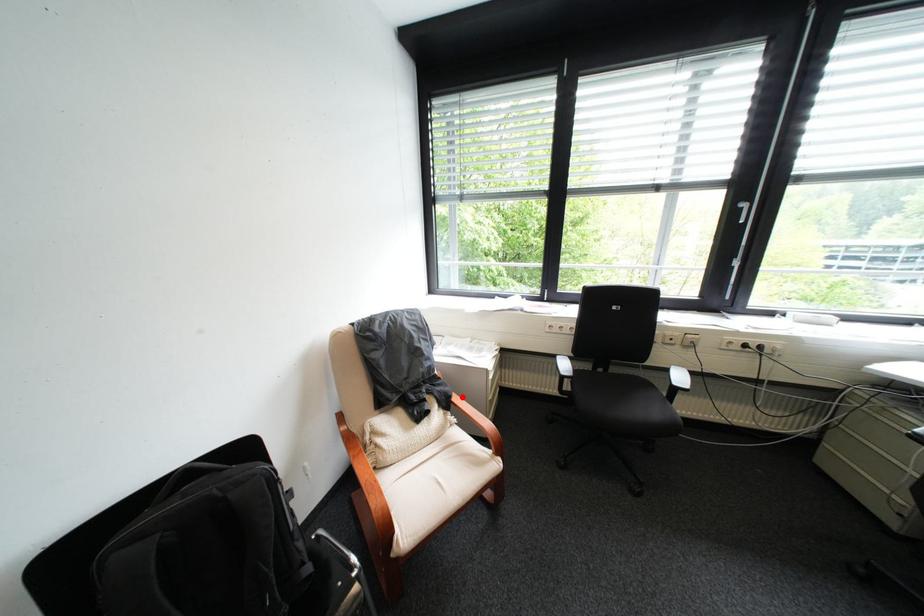
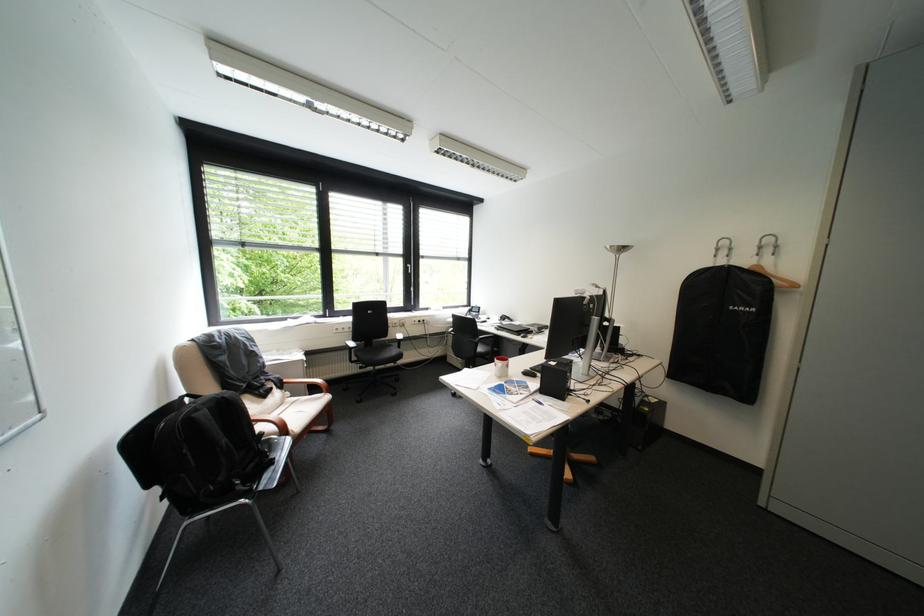
Question: A red point is marked in image1. In image2, is the corresponding 3D point closer to the camera or farther? Reply with the corresponding letter.

Choices:
 (A) The corresponding 3D point is closer.
 (B) The corresponding 3D point is farther.

Answer: (A)